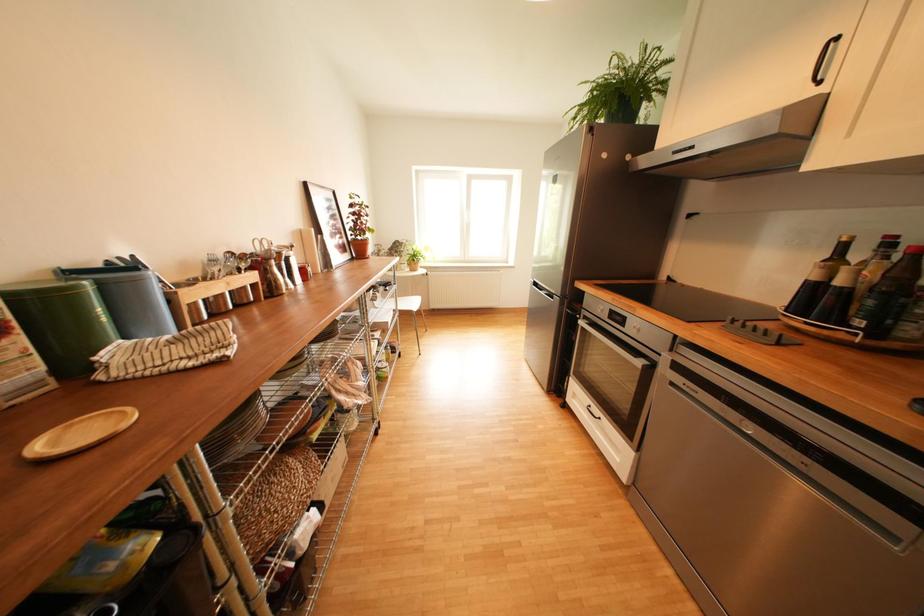
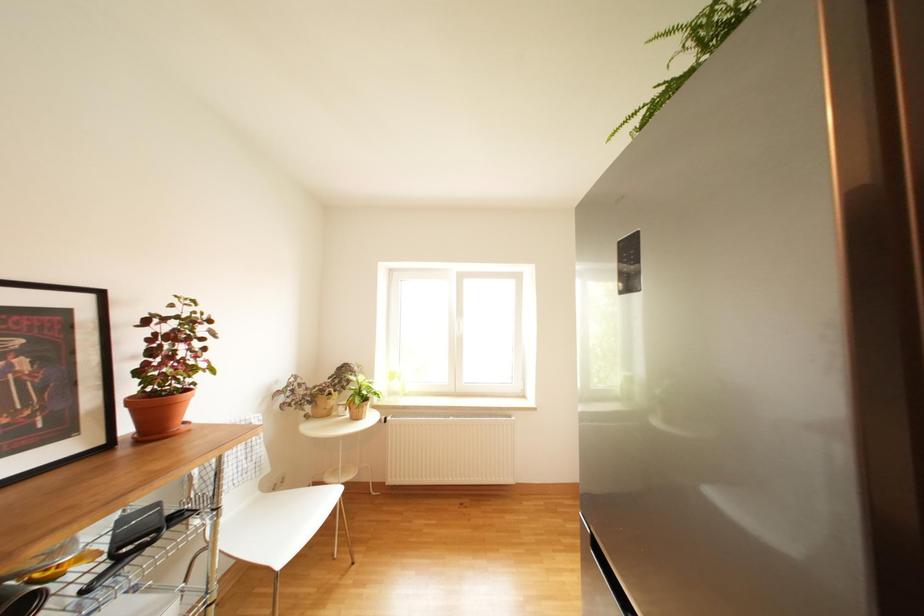
Question: The images are taken continuously from a first-person perspective. In which direction are you moving?

Choices:
 (A) Left
 (B) Right
 (C) Forward
 (D) Backward

Answer: (C)